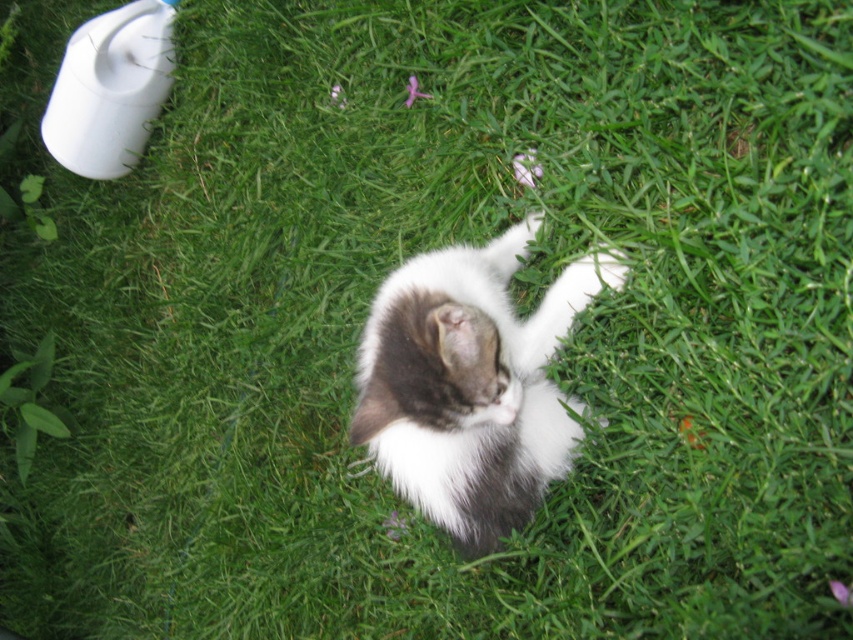
Which is more to the left, fluffy white-gray cat at center or white matte toilet at upper left?

white matte toilet at upper left is more to the left.

Is fluffy white-gray cat at center shorter than white matte toilet at upper left?

In fact, fluffy white-gray cat at center may be taller than white matte toilet at upper left.

Locate an element on the screen. The image size is (853, 640). fluffy white-gray cat at center is located at coordinates (469, 385).